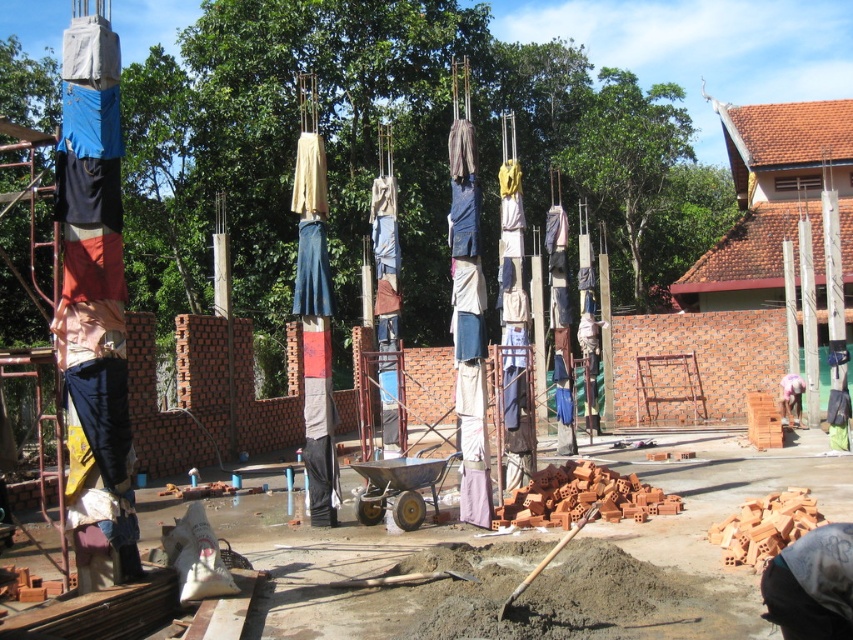
You are an observer standing in front of the construction site. You notice two fabrics hanging from the vertical poles at the center. Which fabric has a smaller width between the light brown fabric at center and the light pink fabric at center?

The light brown fabric at center has a smaller width compared to the light pink fabric at center, as stated in the description.

You are a construction worker who needs to retrieve a fabric from the center area. Which fabric, the light brown fabric at center or the light pink fabric at center, is easier to reach without moving any other objects?

The light brown fabric at center is easier to reach because it is closer to the viewer than the light pink fabric at center.

You are an observer looking at the construction site. You notice two fabrics hanging on the poles at the center. Which fabric is positioned higher up between the light brown fabric at center and the light pink fabric at center?

The light brown fabric at center is positioned higher up than the light pink fabric at center.